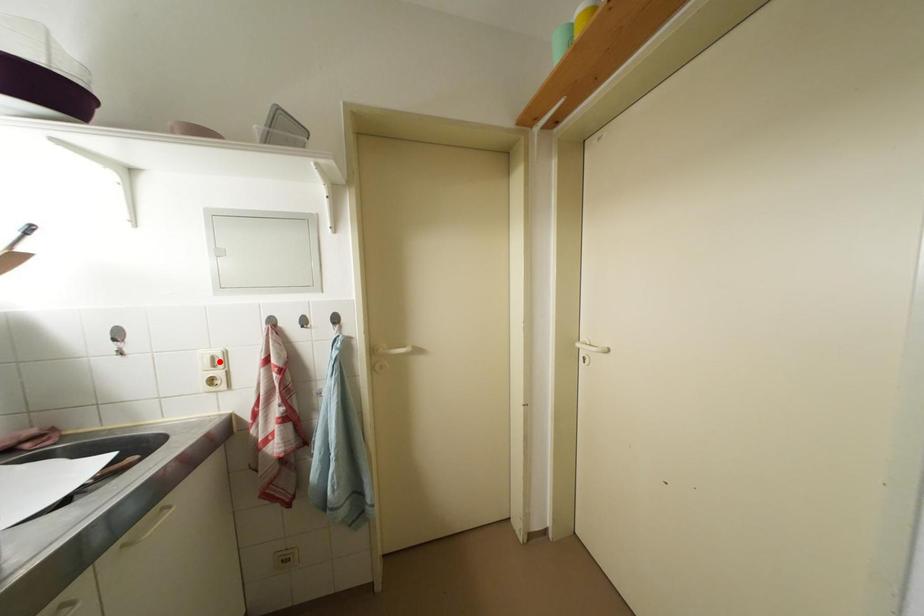
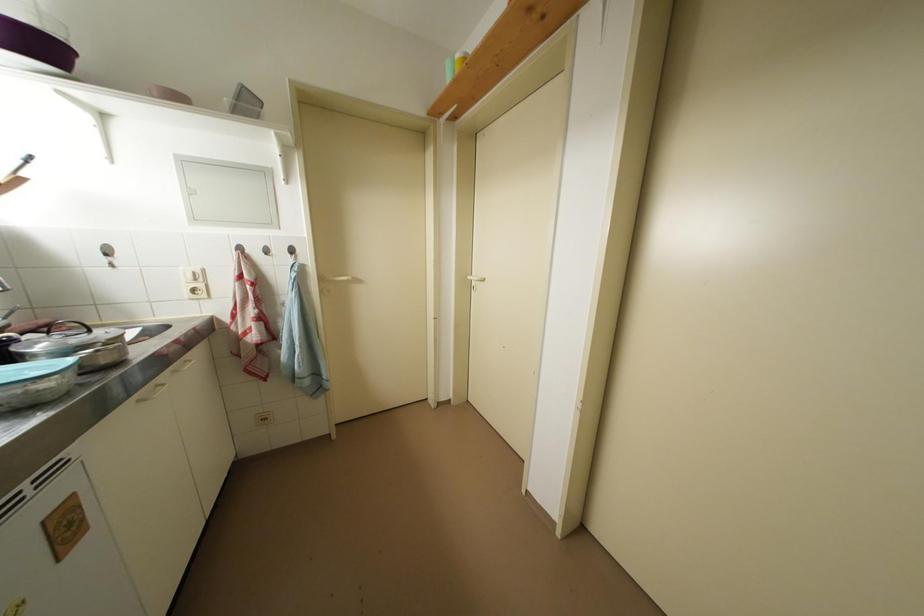
The point at the highlighted location is marked in the first image. Where is the corresponding point in the second image?

(201, 277)